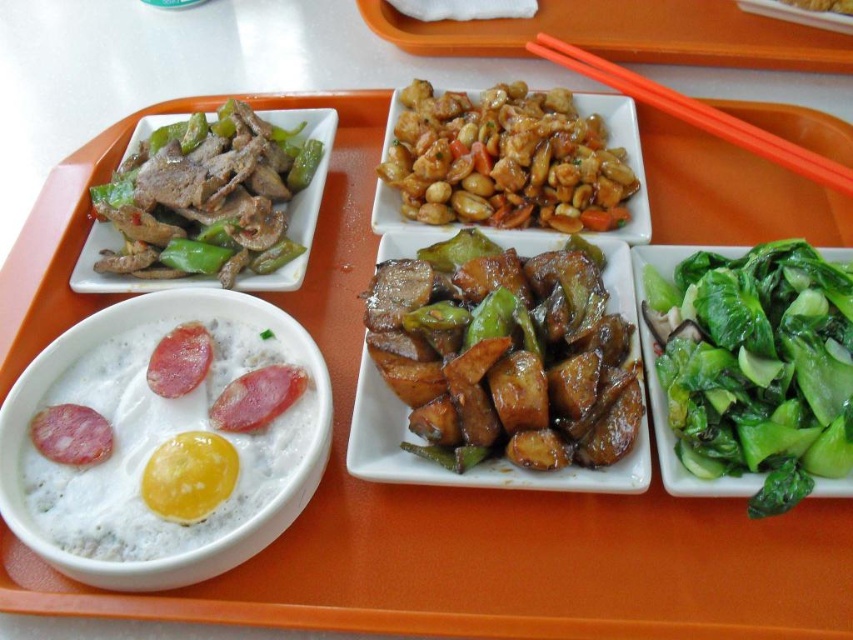
Question: Which object is farther from the camera taking this photo?

Choices:
 (A) brown glossy peanuts at center
 (B) orange plastic chopsticks at upper right
 (C) white creamy egg at bottom left
 (D) shiny plastic chopsticks at upper right

Answer: (D)

Question: Does shiny brown eggplant at center have a lesser width compared to white creamy egg at bottom left?

Choices:
 (A) yes
 (B) no

Answer: (B)

Question: In this image, where is green glossy stir-fried liver and peppers at upper left located relative to shiny plastic chopsticks at upper right?

Choices:
 (A) below
 (B) above

Answer: (A)

Question: Does shiny brown eggplant at center appear under brown glossy peanuts at center?

Choices:
 (A) yes
 (B) no

Answer: (A)

Question: Based on their relative distances, which object is nearer to the green leafy vegetables at lower right?

Choices:
 (A) white creamy egg at bottom left
 (B) brown glossy peanuts at center
 (C) green glossy stir-fried liver and peppers at upper left

Answer: (B)

Question: Estimate the real-world distances between objects in this image. Which object is farther from the white creamy egg at bottom left?

Choices:
 (A) green glossy stir-fried liver and peppers at upper left
 (B) shiny plastic chopsticks at upper right
 (C) brown glossy peanuts at center
 (D) shiny brown eggplant at center

Answer: (B)